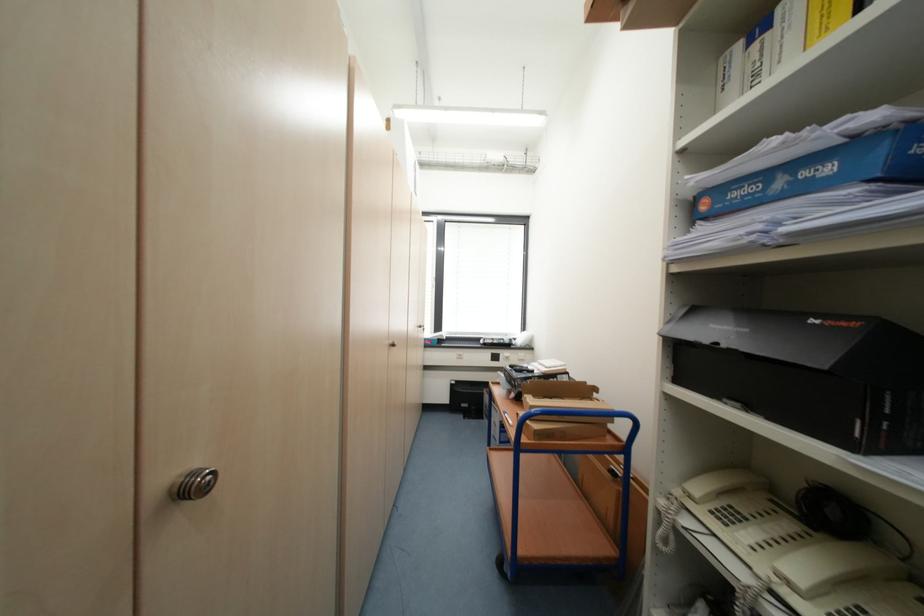
Find where to push the blue trolley handle. Please return your answer as a coordinate pair (x, y).

(566, 428)